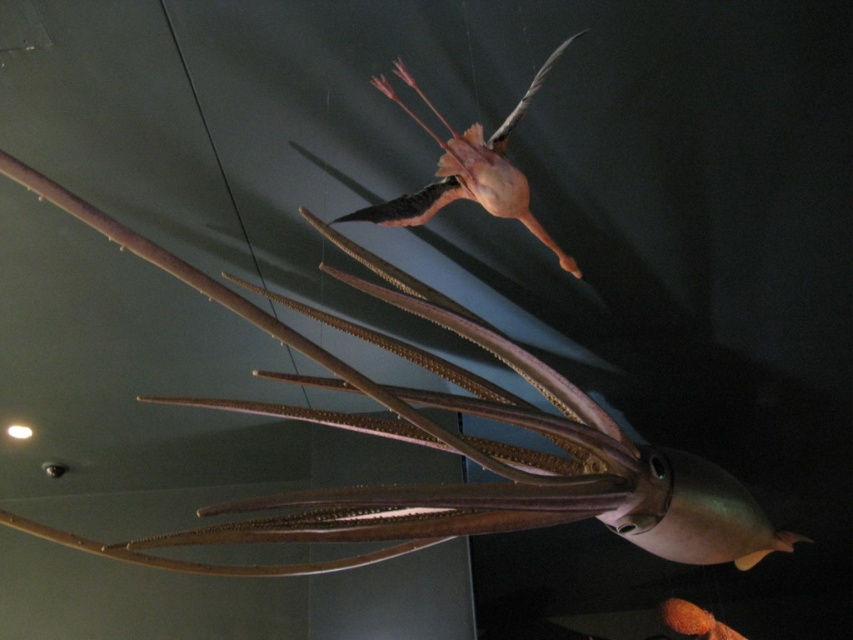
Question: Considering the relative positions of shiny metallic squid at upper center and pink matte squid at upper center in the image provided, where is shiny metallic squid at upper center located with respect to pink matte squid at upper center?

Choices:
 (A) below
 (B) above

Answer: (A)

Question: Which point is farther to the camera?

Choices:
 (A) pink matte squid at upper center
 (B) shiny metallic squid at upper center

Answer: (A)

Question: Which point is closer to the camera taking this photo?

Choices:
 (A) (613, 492)
 (B) (527, 104)

Answer: (B)

Question: Does shiny metallic squid at upper center appear over pink matte squid at upper center?

Choices:
 (A) no
 (B) yes

Answer: (A)

Question: Does shiny metallic squid at upper center have a lesser width compared to pink matte squid at upper center?

Choices:
 (A) no
 (B) yes

Answer: (A)

Question: Which object is closer to the camera taking this photo?

Choices:
 (A) shiny metallic squid at upper center
 (B) pink matte squid at upper center

Answer: (A)